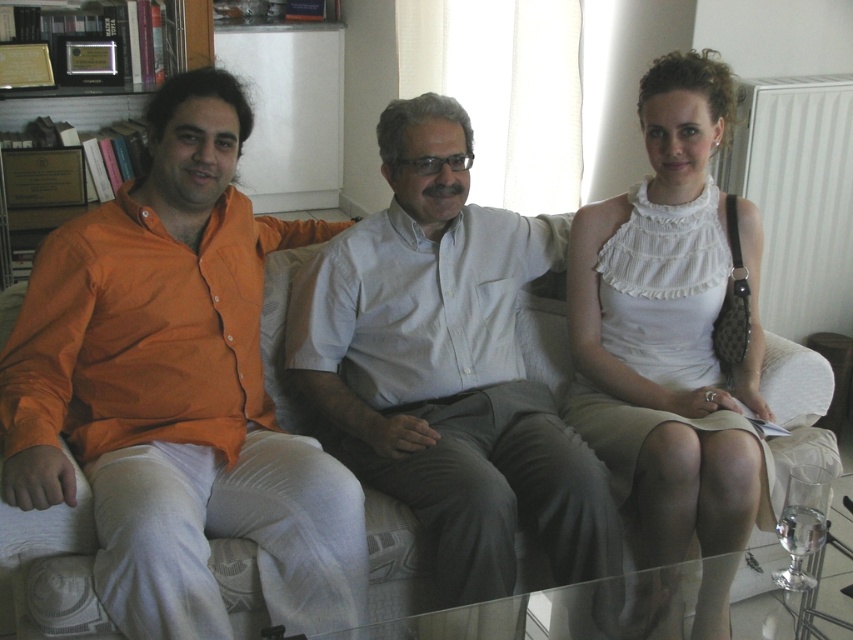
Looking at this image, can you confirm if orange cotton shirt at left is bigger than wooden bookshelf at upper left?

Yes, orange cotton shirt at left is bigger than wooden bookshelf at upper left.

Which of these two, orange cotton shirt at left or wooden bookshelf at upper left, stands shorter?

With less height is wooden bookshelf at upper left.

Is point (138, 212) positioned in front of point (189, 33)?

That is True.

Image resolution: width=853 pixels, height=640 pixels. Find the location of `orange cotton shirt at left`. orange cotton shirt at left is located at coordinates (177, 390).

Is point (103, 596) positioned in front of point (578, 452)?

Yes, point (103, 596) is in front of point (578, 452).

Which is in front, point (219, 637) or point (415, 420)?

Positioned in front is point (219, 637).

The height and width of the screenshot is (640, 853). What are the coordinates of `orange cotton shirt at left` in the screenshot? It's located at (177, 390).

Can you confirm if white cotton shirt at center is positioned to the right of wooden bookshelf at upper left?

Indeed, white cotton shirt at center is positioned on the right side of wooden bookshelf at upper left.

Locate an element on the screen. white cotton shirt at center is located at coordinates (445, 368).